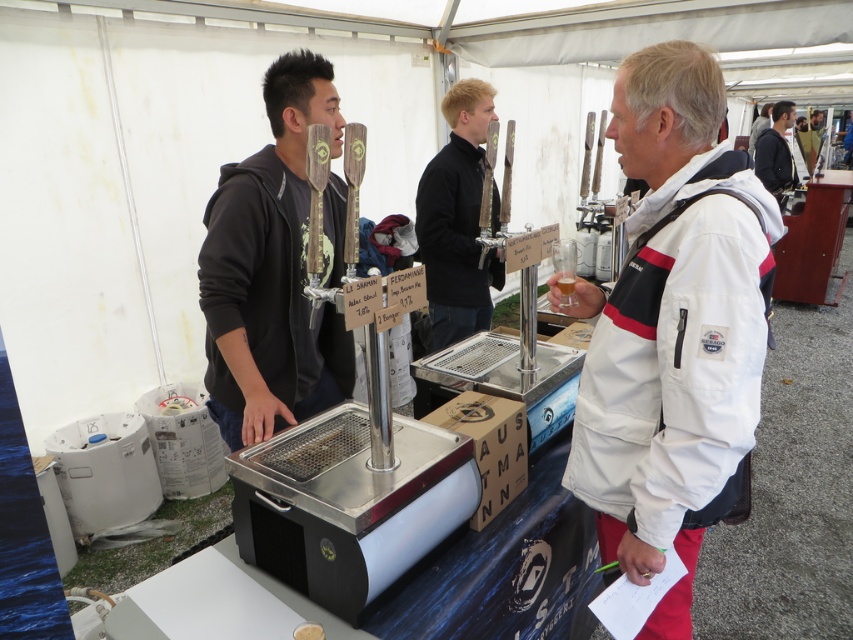
Where is `black hoodie at center`? The height and width of the screenshot is (640, 853). black hoodie at center is located at coordinates (270, 272).

Is point (289, 301) closer to viewer compared to point (793, 179)?

Yes, point (289, 301) is closer to viewer.

Locate an element on the screen. The image size is (853, 640). black hoodie at center is located at coordinates (270, 272).

At what (x,y) coordinates should I click in order to perform the action: click on black hoodie at center. Please return your answer as a coordinate pair (x, y). The height and width of the screenshot is (640, 853). Looking at the image, I should click on (270, 272).

Is black matte shirt at center bigger than dark gray hoodie at upper center?

Incorrect, black matte shirt at center is not larger than dark gray hoodie at upper center.

Does point (474, 230) come closer to viewer compared to point (788, 156)?

Yes, it is.

Locate an element on the screen. black matte shirt at center is located at coordinates (456, 220).

Is white softshell jacket at center shorter than black matte shirt at center?

Incorrect, white softshell jacket at center's height does not fall short of black matte shirt at center's.

Can you confirm if white softshell jacket at center is positioned below black matte shirt at center?

Yes.

The width and height of the screenshot is (853, 640). I want to click on white softshell jacket at center, so click(x=672, y=330).